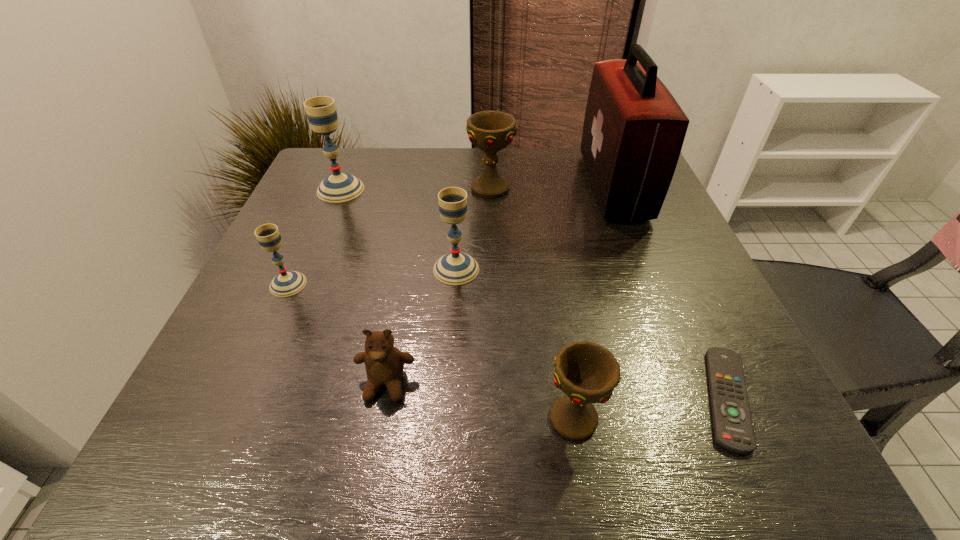
Locate an element on the screen. free space at the far edge of the desktop is located at coordinates (447, 159).

In order to click on vacant space at the near edge of the desktop in this screenshot , I will do `click(371, 457)`.

At what (x,y) coordinates should I click in order to perform the action: click on vacant space at the left edge. Please return your answer as a coordinate pair (x, y). This screenshot has width=960, height=540. Looking at the image, I should click on (249, 318).

In the image, there is a desktop. Where is `free region at the right edge`? This screenshot has height=540, width=960. free region at the right edge is located at coordinates (x=677, y=246).

You are a GUI agent. You are given a task and a screenshot of the screen. Output one action in this format:
    pyautogui.click(x=<x>, y=<y>)
    Task: Click on the vacant point at the far left corner
    This screenshot has width=960, height=540.
    Given the screenshot: What is the action you would take?
    pyautogui.click(x=318, y=177)

Find the location of a particular element. vacant space at the near left corner is located at coordinates (257, 421).

You are a GUI agent. You are given a task and a screenshot of the screen. Output one action in this format:
    pyautogui.click(x=<x>, y=<y>)
    Task: Click on the vacant area between the second smallest gray chalice and the left red chalice
    The height and width of the screenshot is (540, 960).
    Given the screenshot: What is the action you would take?
    pyautogui.click(x=473, y=229)

Where is `free space between the teddy bear and the second smallest gray chalice`? The height and width of the screenshot is (540, 960). free space between the teddy bear and the second smallest gray chalice is located at coordinates (421, 326).

Where is `free spot between the rightmost gray chalice and the nearer red chalice`? The height and width of the screenshot is (540, 960). free spot between the rightmost gray chalice and the nearer red chalice is located at coordinates (515, 343).

Locate an element on the screen. Image resolution: width=960 pixels, height=540 pixels. free space that is in between the second smallest gray chalice and the first aid kit is located at coordinates (535, 227).